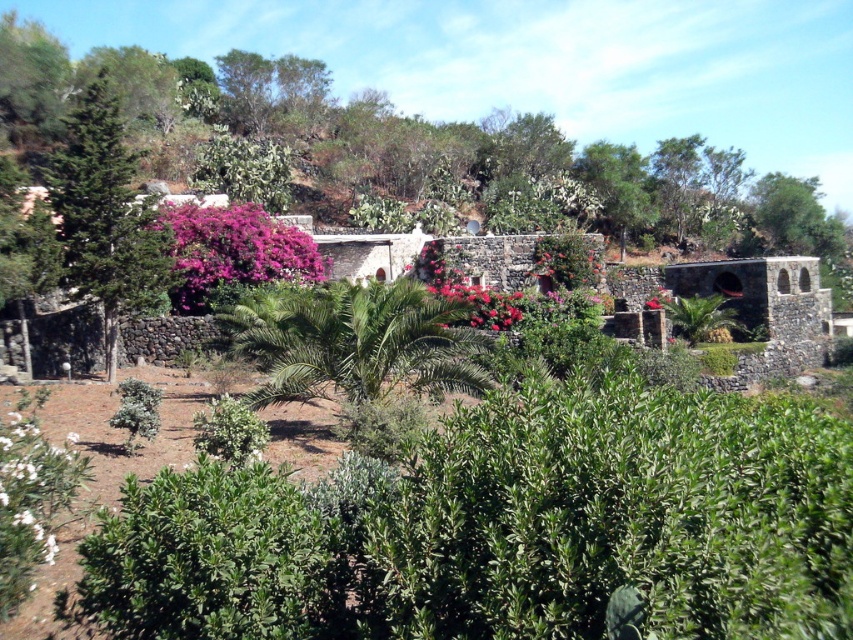
From the picture: Can you confirm if purple matte flowers at left is positioned to the left of white matte flower at lower left?

Correct, you'll find purple matte flowers at left to the left of white matte flower at lower left.

Is purple matte flowers at left positioned behind white matte flower at lower left?

Yes, it is behind white matte flower at lower left.

What are the coordinates of `purple matte flowers at left` in the screenshot? It's located at (233, 252).

Is point (196, 227) farther from viewer compared to point (809, 244)?

No, (196, 227) is in front of (809, 244).

Is point (190, 240) positioned behind point (815, 228)?

No.

Find the location of `purple matte flowers at left`. purple matte flowers at left is located at coordinates (233, 252).

Does green leafy bush at center have a lesser height compared to green textured tree at left?

Yes, green leafy bush at center is shorter than green textured tree at left.

Between point (340, 342) and point (120, 141), which one is positioned in front?

Point (340, 342)

Where is `green leafy bush at center`? This screenshot has height=640, width=853. green leafy bush at center is located at coordinates (357, 340).